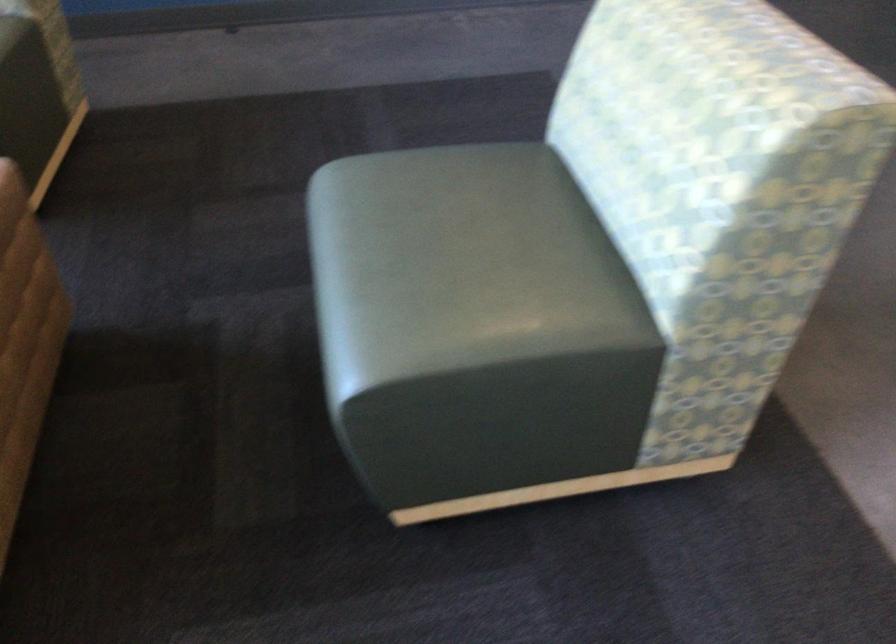
This screenshot has height=644, width=896. What are the coordinates of `green chair sitting surface` in the screenshot? It's located at (x=460, y=265).